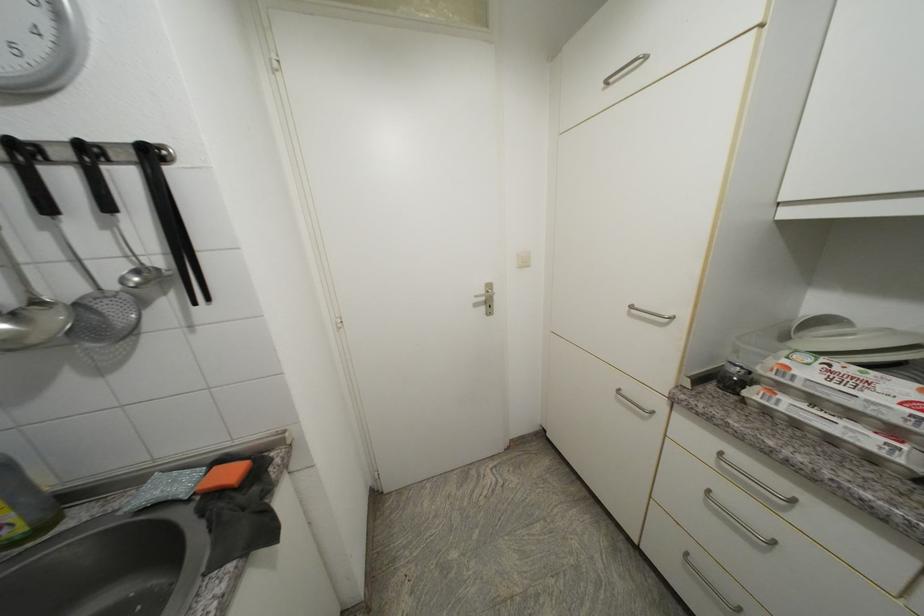
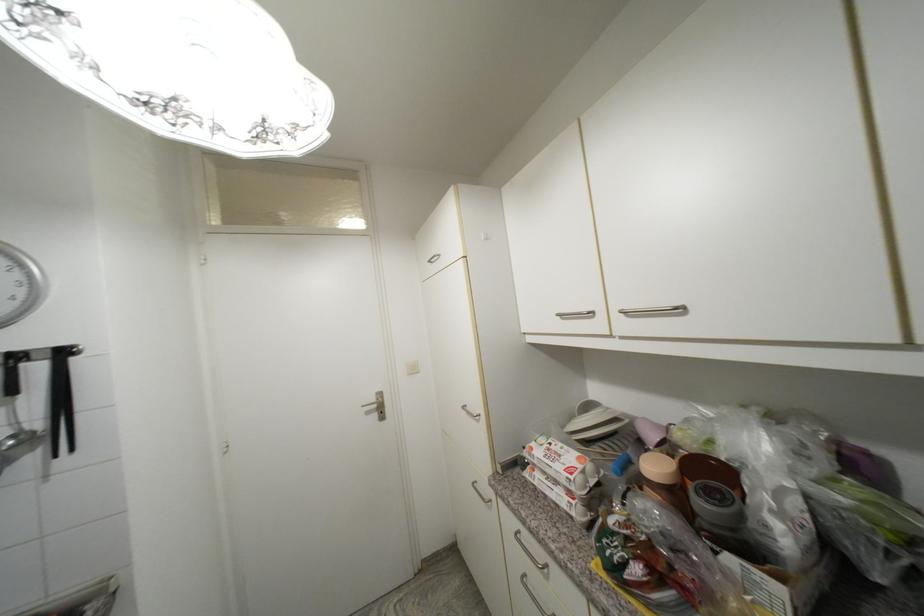
Find the pixel in the second image that matches point 156,156 in the first image.

(69, 354)